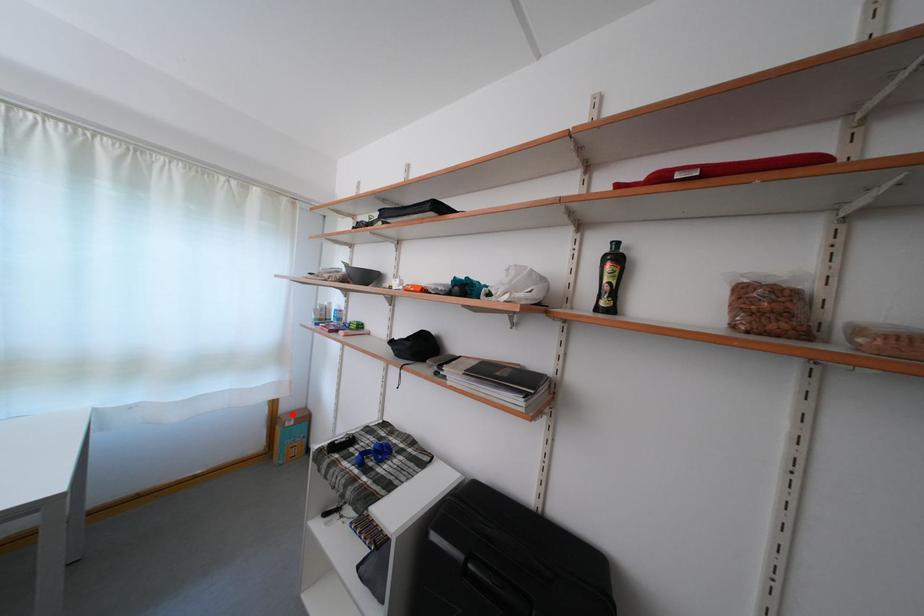
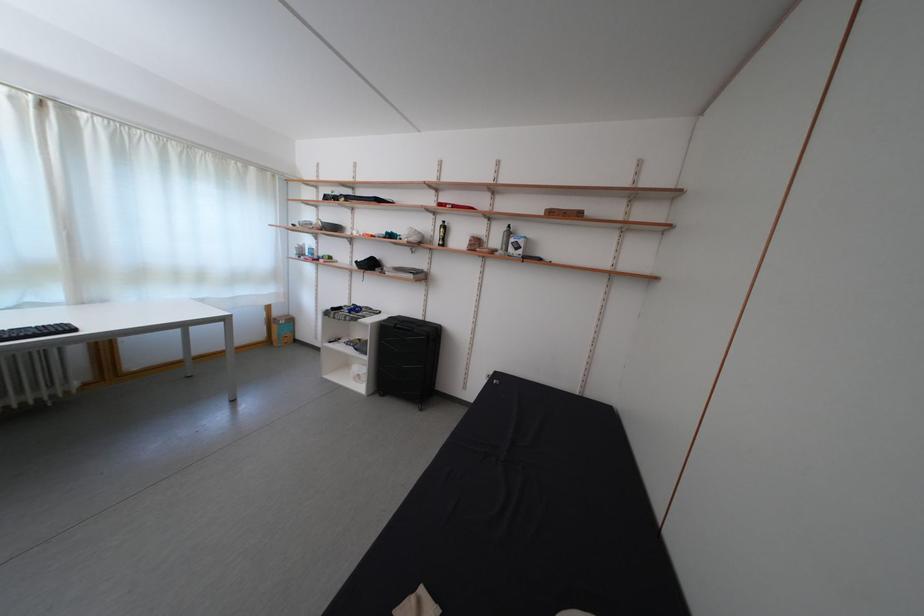
Question: I am providing you with two images of the same scene from different viewpoints. Image1 has a red point marked. In image2, the corresponding 3D location appears at what relative position? Reply with the corresponding letter.

Choices:
 (A) Closer
 (B) Farther

Answer: (B)